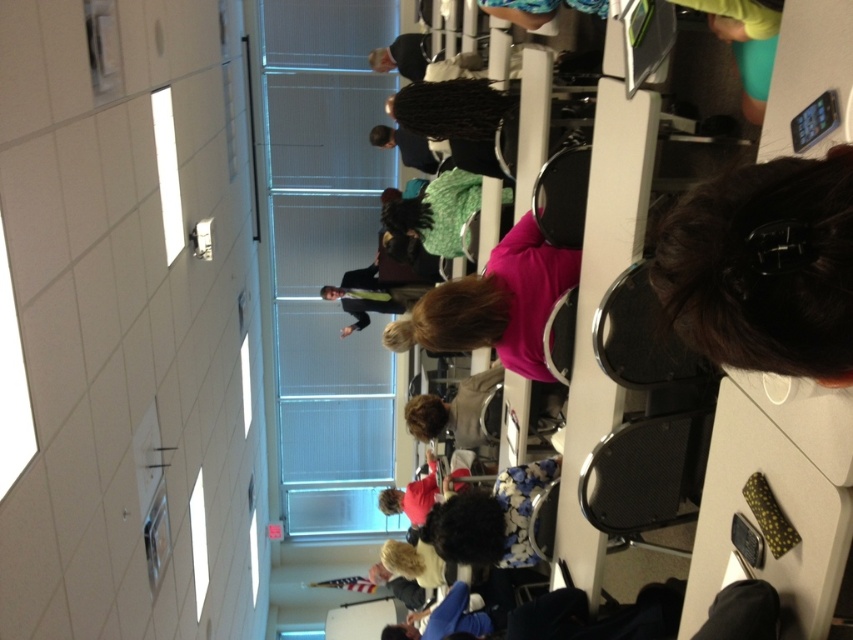
You are an event planner checking the seating arrangement. You need to determine if the dark brown hair at upper right can be seen over the pink matte shirt at center from your current viewpoint. Can they?

The dark brown hair at upper right is shorter than the pink matte shirt at center, so it is unlikely that the dark brown hair at upper right can be seen over the pink matte shirt at center from your current viewpoint.

You are standing in the conference room and want to reach a specific point marked as point [824,189]. If your average walking speed is 3 feet per second, how many seconds will it take you to reach that point?

The distance between point [824,189] and the camera is 36.40 inches. Converting that to feet, it is 36.40 divided by 12 equals approximately 3.03 feet. At a speed of 3 feet per second, the time required is 3.03 divided by 3 equals approximately 1.01 seconds. So, it will take roughly 1 second to reach the point.

You are standing in the conference room and want to locate the person with dark brown hair at upper right. What coordinates should you look at?

You should look at point (764,268) to find the dark brown hair at upper right.